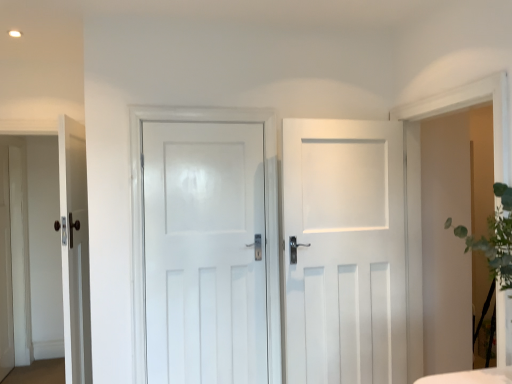
Question: Is matte white door at left, the first door when ordered from left to right, with white glossy door at center, the 2th door when ordered from left to right?

Choices:
 (A) no
 (B) yes

Answer: (A)

Question: Does matte white door at left, the first door when ordered from left to right, have a greater width compared to white glossy door at center, the 2th door when ordered from left to right?

Choices:
 (A) no
 (B) yes

Answer: (B)

Question: From the image's perspective, is matte white door at left, the first door when ordered from left to right, above white glossy door at center, the 2th door when ordered from left to right?

Choices:
 (A) no
 (B) yes

Answer: (A)

Question: Is matte white door at left, positioned as the third door in right-to-left order, positioned behind white glossy door at center, marked as the second door in a right-to-left arrangement?

Choices:
 (A) no
 (B) yes

Answer: (A)

Question: Considering the relative sizes of matte white door at left, the first door when ordered from left to right, and white glossy door at center, the 2th door when ordered from left to right, in the image provided, is matte white door at left, the first door when ordered from left to right, shorter than white glossy door at center, the 2th door when ordered from left to right,?

Choices:
 (A) yes
 (B) no

Answer: (B)

Question: Is the position of matte white door at left, the first door when ordered from left to right, less distant than that of white glossy door at center, the 2th door when ordered from left to right?

Choices:
 (A) no
 (B) yes

Answer: (B)

Question: Is white glossy door at center, the 2th door when ordered from left to right, facing away from matte white door at left, positioned as the third door in right-to-left order?

Choices:
 (A) yes
 (B) no

Answer: (B)

Question: Considering the relative sizes of white glossy door at center, marked as the second door in a right-to-left arrangement, and matte white door at left, the first door when ordered from left to right, in the image provided, is white glossy door at center, marked as the second door in a right-to-left arrangement, bigger than matte white door at left, the first door when ordered from left to right,?

Choices:
 (A) yes
 (B) no

Answer: (B)

Question: From the image's perspective, would you say white glossy door at center, the 2th door when ordered from left to right, is shown under matte white door at left, the first door when ordered from left to right?

Choices:
 (A) yes
 (B) no

Answer: (B)

Question: From the image's perspective, would you say white glossy door at center, marked as the second door in a right-to-left arrangement, is positioned over matte white door at left, positioned as the third door in right-to-left order?

Choices:
 (A) no
 (B) yes

Answer: (B)

Question: Is white glossy door at center, marked as the second door in a right-to-left arrangement, aimed at matte white door at left, positioned as the third door in right-to-left order?

Choices:
 (A) no
 (B) yes

Answer: (A)

Question: Are white glossy door at center, marked as the second door in a right-to-left arrangement, and matte white door at left, the first door when ordered from left to right, located far from each other?

Choices:
 (A) no
 (B) yes

Answer: (A)

Question: From a real-world perspective, is white matte door at center, which is the third door in left-to-right order, located beneath matte white door at left, positioned as the third door in right-to-left order?

Choices:
 (A) no
 (B) yes

Answer: (A)